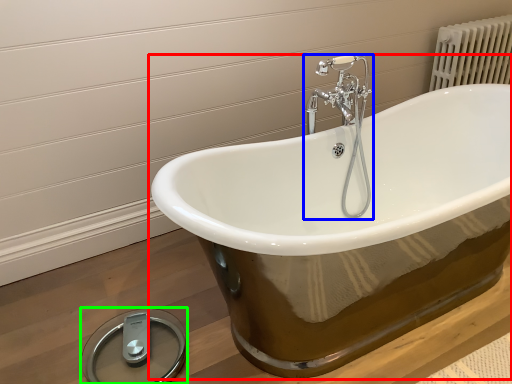
Question: Which object is positioned farthest from bathtub (highlighted by a red box)? Select from tap (highlighted by a blue box) and scale (highlighted by a green box).

Choices:
 (A) tap
 (B) scale

Answer: (B)